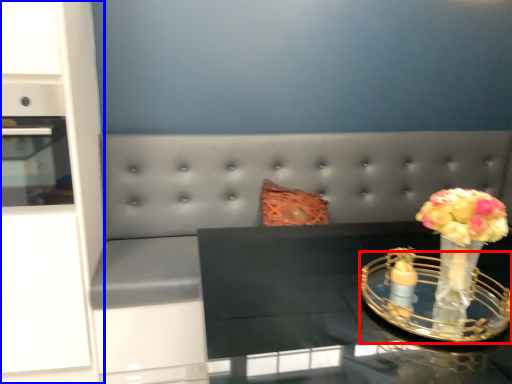
Question: Which of the following is the closest to the observer, candle holder (highlighted by a red box) or dresser (highlighted by a blue box)?

Choices:
 (A) candle holder
 (B) dresser

Answer: (A)